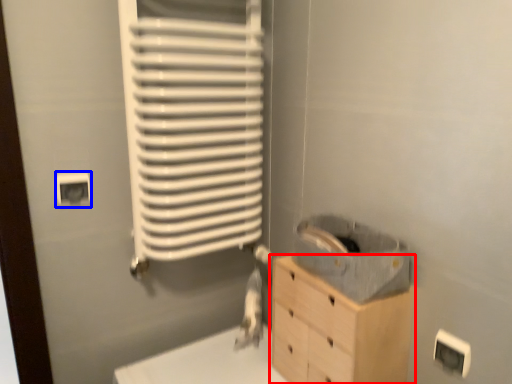
Question: Among these objects, which one is farthest to the camera, chest of drawers (highlighted by a red box) or electric outlet (highlighted by a blue box)?

Choices:
 (A) chest of drawers
 (B) electric outlet

Answer: (B)